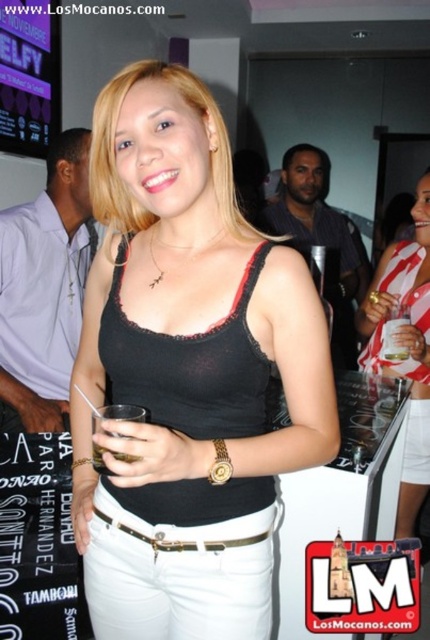
Please look at the scene and identify which object is smaller between the black matte tank top at center and the matte black tank top at center?

The black matte tank top at center is smaller compared to the matte black tank top at center.

You are organizing a clothing display and need to place the black matte tank top at center and the gold metallic belt at center on a shelf. The shelf has a width of 40 cm. If the tank top takes up 25 cm of space, will the belt fit alongside it?

The black matte tank top at center might be wider than the gold metallic belt at center. Since the tank top takes up 25 cm, there is 15 cm remaining. If the belt is narrower than 15 cm, it could fit. However, since the description states the tank top might be wider, we cannot confirm for certain without exact measurements.